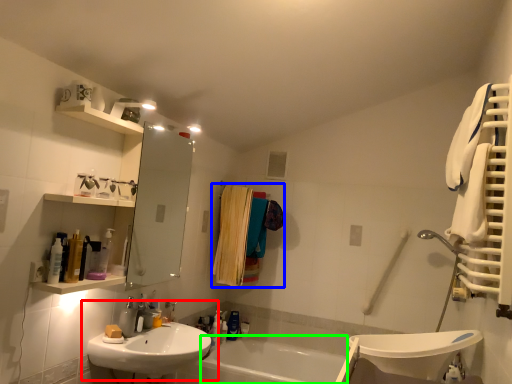
Question: Considering the real-world distances, which object is closest to sink (highlighted by a red box)? laundry (highlighted by a blue box) or bath (highlighted by a green box).

Choices:
 (A) laundry
 (B) bath

Answer: (A)